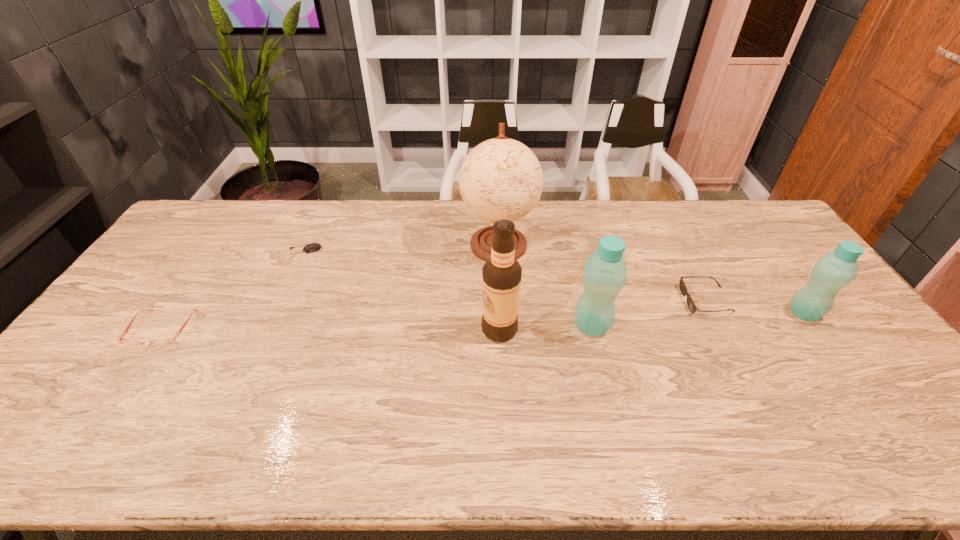
Identify the location of vacant position located 0.200m on the left of the taller bottle. The image size is (960, 540). (501, 326).

Identify the location of vacant space located 0.170m on the back of the rightmost object. The height and width of the screenshot is (540, 960). click(769, 264).

Find the location of `free location located on the surface of the globe`. free location located on the surface of the globe is located at coordinates (504, 365).

Locate an element on the screen. This screenshot has height=540, width=960. vacant region located 0.050m on the back of the sixth object from right to left is located at coordinates (311, 235).

At what (x,y) coordinates should I click in order to perform the action: click on free space located 0.310m on the label of the alcohol. Please return your answer as a coordinate pair (x, y). Looking at the image, I should click on (371, 329).

Identify the location of vacant area situated 0.300m on the label of the alcohol. tap(374, 329).

Identify the location of vacant space situated on the label of the alcohol. (445, 329).

I want to click on vacant point located on the front-facing side of the second object from right to left, so [x=660, y=300].

Where is `vacant region located 0.400m on the front-facing side of the second object from right to left`? The width and height of the screenshot is (960, 540). vacant region located 0.400m on the front-facing side of the second object from right to left is located at coordinates (550, 300).

At what (x,y) coordinates should I click in order to perform the action: click on free space located 0.160m on the front-facing side of the second object from right to left. Please return your answer as a coordinate pair (x, y). This screenshot has height=540, width=960. Looking at the image, I should click on (630, 300).